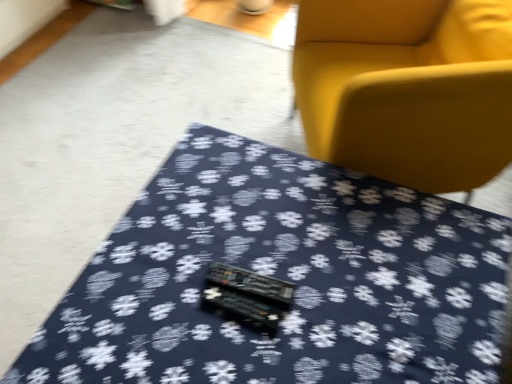
From the picture: What is the approximate width of dark blue fabric at center?

dark blue fabric at center is 3.57 feet wide.

Locate an element on the screen. dark blue fabric at center is located at coordinates (281, 278).

Image resolution: width=512 pixels, height=384 pixels. What do you see at coordinates (281, 278) in the screenshot?
I see `dark blue fabric at center` at bounding box center [281, 278].

In order to face matte yellow armchair at upper right, should I rotate leftwards or rightwards?

To face it directly, rotate right by 18.593 degrees.

This screenshot has height=384, width=512. What do you see at coordinates (399, 95) in the screenshot? I see `matte yellow armchair at upper right` at bounding box center [399, 95].

Image resolution: width=512 pixels, height=384 pixels. I want to click on matte yellow armchair at upper right, so click(x=399, y=95).

At what (x,y) coordinates should I click in order to perform the action: click on dark blue fabric at center. Please return your answer as a coordinate pair (x, y). Image resolution: width=512 pixels, height=384 pixels. Looking at the image, I should click on (281, 278).

From the picture: Between dark blue fabric at center and matte yellow armchair at upper right, which one appears on the left side from the viewer's perspective?

From the viewer's perspective, dark blue fabric at center appears more on the left side.

Considering the positions of objects dark blue fabric at center and matte yellow armchair at upper right in the image provided, who is in front, dark blue fabric at center or matte yellow armchair at upper right?

dark blue fabric at center.

Considering the positions of points (231, 215) and (478, 73), is point (231, 215) closer to camera compared to point (478, 73)?

Yes, it is.

In the scene shown: From the image's perspective, between dark blue fabric at center and matte yellow armchair at upper right, which one is located above?

matte yellow armchair at upper right.

From a real-world perspective, which object rests below the other?

From a 3D spatial view, dark blue fabric at center is below.

Considering the sizes of dark blue fabric at center and matte yellow armchair at upper right in the image, is dark blue fabric at center wider or thinner than matte yellow armchair at upper right?

dark blue fabric at center is wider than matte yellow armchair at upper right.

Considering the relative sizes of dark blue fabric at center and matte yellow armchair at upper right in the image provided, is dark blue fabric at center taller than matte yellow armchair at upper right?

Incorrect, the height of dark blue fabric at center is not larger of that of matte yellow armchair at upper right.

Based on the photo, between dark blue fabric at center and matte yellow armchair at upper right, which one has smaller size?

dark blue fabric at center.

Is dark blue fabric at center surrounding matte yellow armchair at upper right?

No, dark blue fabric at center does not contain matte yellow armchair at upper right.

Is dark blue fabric at center not close to matte yellow armchair at upper right?

dark blue fabric at center is near matte yellow armchair at upper right, not far away.

Is dark blue fabric at center turned away from matte yellow armchair at upper right?

No.

This screenshot has width=512, height=384. I want to click on chair behind the dark blue fabric at center, so click(x=399, y=95).

In the scene shown: Can you confirm if matte yellow armchair at upper right is positioned to the left of dark blue fabric at center?

No, matte yellow armchair at upper right is not to the left of dark blue fabric at center.

Which object is closer to the camera, matte yellow armchair at upper right or dark blue fabric at center?

dark blue fabric at center is in front.

Is point (362, 127) in front of point (239, 245)?

No, it is behind (239, 245).

From the image's perspective, which one is positioned higher, matte yellow armchair at upper right or dark blue fabric at center?

matte yellow armchair at upper right, from the image's perspective.

From a real-world perspective, is matte yellow armchair at upper right on dark blue fabric at center?

Yes, from a real-world perspective, matte yellow armchair at upper right is on top of dark blue fabric at center.

Which of these two, matte yellow armchair at upper right or dark blue fabric at center, is wider?

dark blue fabric at center is wider.

Based on the photo, considering the sizes of objects matte yellow armchair at upper right and dark blue fabric at center in the image provided, who is shorter, matte yellow armchair at upper right or dark blue fabric at center?

With less height is dark blue fabric at center.

Consider the image. Considering the relative sizes of matte yellow armchair at upper right and dark blue fabric at center in the image provided, is matte yellow armchair at upper right bigger than dark blue fabric at center?

Yes, matte yellow armchair at upper right is bigger than dark blue fabric at center.

Is matte yellow armchair at upper right not within dark blue fabric at center?

Yes, matte yellow armchair at upper right is not within dark blue fabric at center.

Looking at this image, is matte yellow armchair at upper right in contact with dark blue fabric at center?

No, matte yellow armchair at upper right is not making contact with dark blue fabric at center.

Does matte yellow armchair at upper right turn towards dark blue fabric at center?

No.

How many degrees apart are the facing directions of matte yellow armchair at upper right and dark blue fabric at center?

The angle between the facing direction of matte yellow armchair at upper right and the facing direction of dark blue fabric at center is 29.1 degrees.

At what (x,y) coordinates should I click in order to perform the action: click on chair above the dark blue fabric at center (from a real-world perspective). Please return your answer as a coordinate pair (x, y). The width and height of the screenshot is (512, 384). Looking at the image, I should click on (399, 95).

Find the location of `chair on the right side of dark blue fabric at center`. chair on the right side of dark blue fabric at center is located at coordinates (399, 95).

Find the location of a particular element. This screenshot has height=384, width=512. table below the matte yellow armchair at upper right (from the image's perspective) is located at coordinates (281, 278).